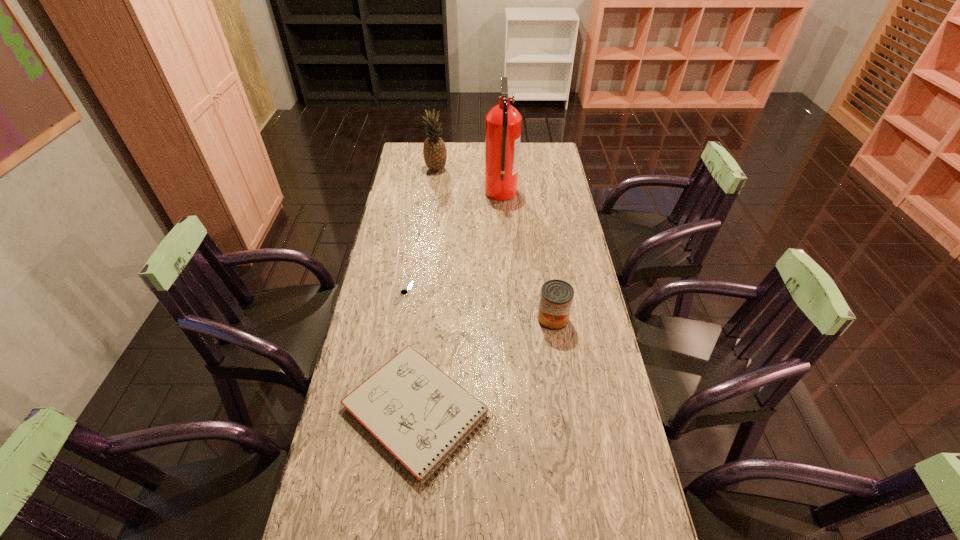
This screenshot has height=540, width=960. I want to click on watch positioned at the left edge, so click(x=404, y=292).

The image size is (960, 540). What are the coordinates of `object situated at the right edge` in the screenshot? It's located at (556, 297).

This screenshot has height=540, width=960. Identify the location of object positioned at the far left corner. pos(434,150).

Locate an element on the screen. vacant space at the left edge of the desktop is located at coordinates (362, 373).

Identify the location of vacant space at the right edge of the desktop. The height and width of the screenshot is (540, 960). (580, 310).

This screenshot has height=540, width=960. In the image, there is a desktop. Find the location of `vacant space at the far right corner`. vacant space at the far right corner is located at coordinates (527, 164).

This screenshot has width=960, height=540. What are the coordinates of `free space between the second nearest object and the watch` in the screenshot? It's located at point(479,306).

Image resolution: width=960 pixels, height=540 pixels. I want to click on vacant region between the third farthest object and the second farthest object, so click(x=452, y=243).

This screenshot has width=960, height=540. In order to click on vacant space that's between the pineapple and the tallest object in this screenshot , I will do `click(468, 181)`.

I want to click on vacant space in between the rightmost object and the watch, so click(x=479, y=306).